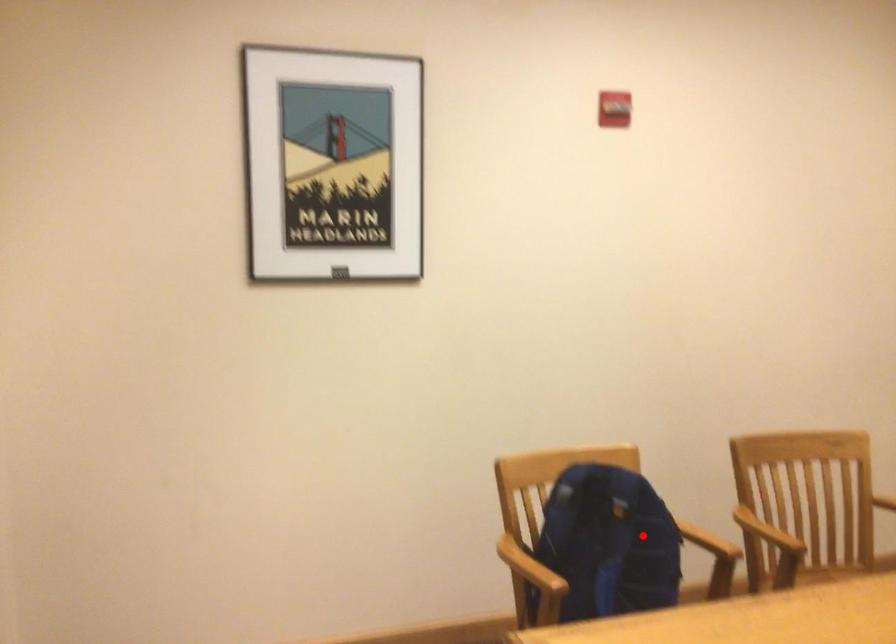
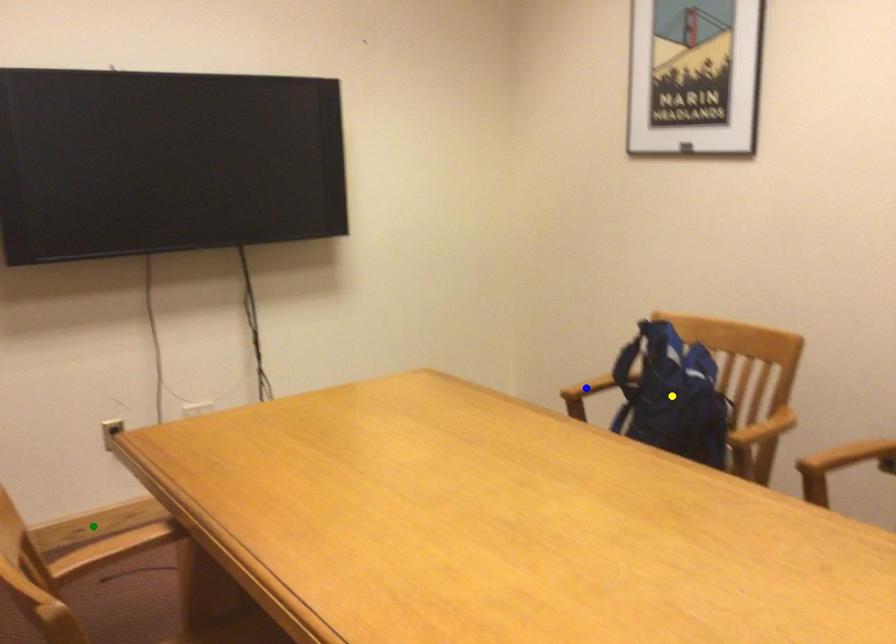
Question: I am providing you with two images of the same scene from different viewpoints. A red point is marked on the first image. You are given multiple points on the second image. Which point in image 2 is actually the same real-world point as the red point in image 1?

Choices:
 (A) yellow point
 (B) blue point
 (C) green point

Answer: (A)